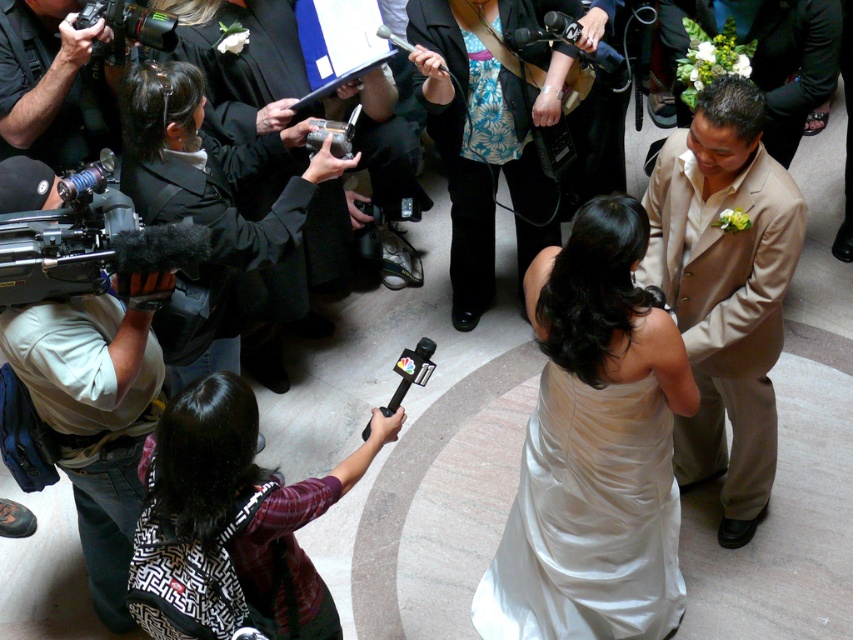
You are a photographer standing at the edge of the crowd. You need to take a clear photo of the tan satin suit at center without moving too close. Given that your camera has a maximum zoom range of 2 meters, can you capture the suit clearly from your current position?

The distance between the tan satin suit at center and the camera is 2.54 meters. Since the camera can only zoom up to 2 meters, it cannot capture the suit clearly from this distance.

You are a photographer at the wedding scene. You need to capture a photo of the satin dress at center without the silver metallic video camera at center appearing in the frame. Based on their positions, is this possible?

The satin dress at center is to the right of the silver metallic video camera at center. Therefore, by positioning yourself to the right side of the camera, you can capture the satin dress at center without the silver metallic video camera at center being in the frame.